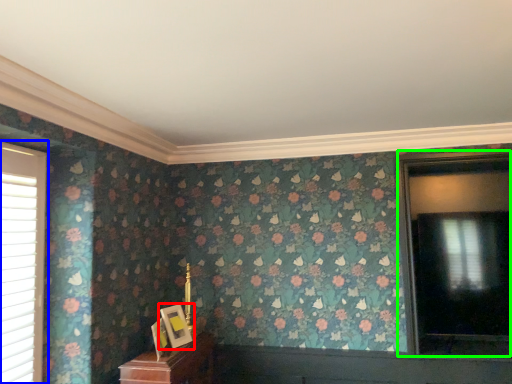
Question: Estimate the real-world distances between objects in this image. Which object is closer to picture frame (highlighted by a red box), window (highlighted by a blue box) or window (highlighted by a green box)?

Choices:
 (A) window
 (B) window

Answer: (A)